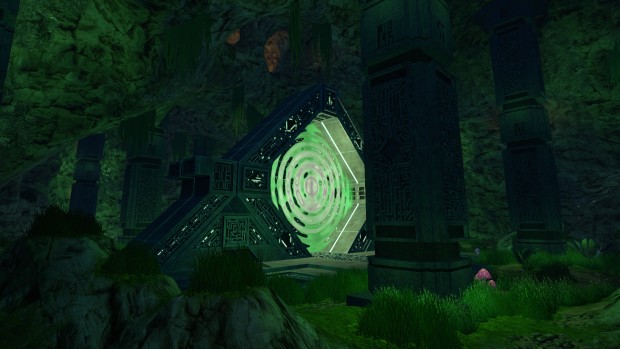
You are a GUI agent. You are given a task and a screenshot of the screen. Output one action in this format:
    pyautogui.click(x=<x>, y=<y>)
    Task: Click on the orange light
    The image size is (620, 349).
    Given the screenshot: What is the action you would take?
    pyautogui.click(x=268, y=49), pyautogui.click(x=235, y=39)